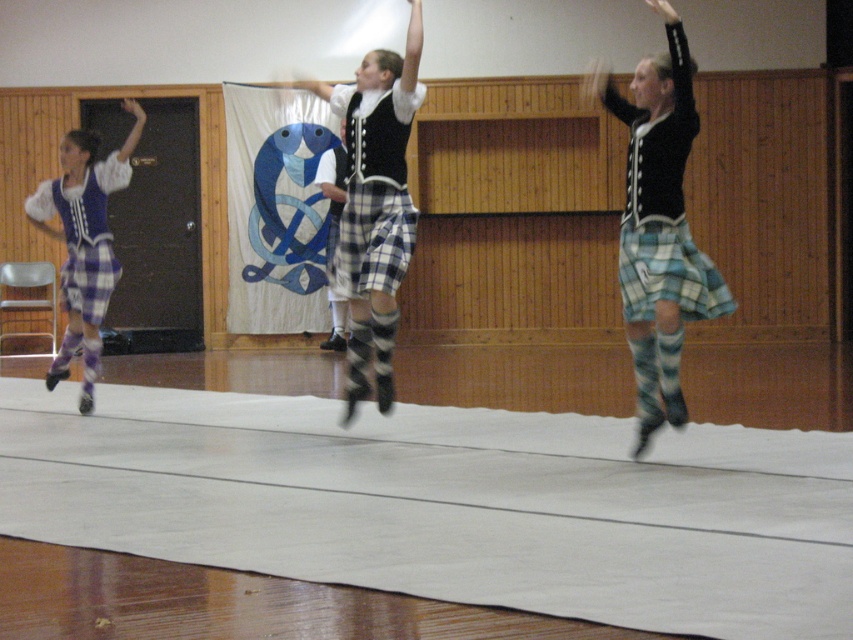
Can you confirm if plaid skirt at center is wider than blue plaid kilt at right?

Correct, the width of plaid skirt at center exceeds that of blue plaid kilt at right.

Is plaid skirt at center to the left of blue plaid kilt at right from the viewer's perspective?

Indeed, plaid skirt at center is positioned on the left side of blue plaid kilt at right.

Measure the distance between point (675, 262) and camera.

22.60 feet

The height and width of the screenshot is (640, 853). Identify the location of plaid skirt at center. (659, 227).

Who is more forward, (84, 364) or (78, 280)?

Point (78, 280) is more forward.

Looking at this image, between plaid fabric skirt at left and plaid fabric kilt at left, which one appears on the right side from the viewer's perspective?

plaid fabric kilt at left

Which is behind, point (85, 310) or point (83, 314)?

Point (83, 314)

This screenshot has width=853, height=640. What are the coordinates of `plaid fabric skirt at left` in the screenshot? It's located at (84, 241).

Is plaid skirt at center positioned at the back of plaid fabric skirt at center?

No.

Does plaid skirt at center appear under plaid fabric skirt at center?

Yes, plaid skirt at center is below plaid fabric skirt at center.

Who is more forward, (657, 248) or (383, 353)?

Point (657, 248) is more forward.

Where is `plaid skirt at center`? This screenshot has height=640, width=853. plaid skirt at center is located at coordinates (659, 227).